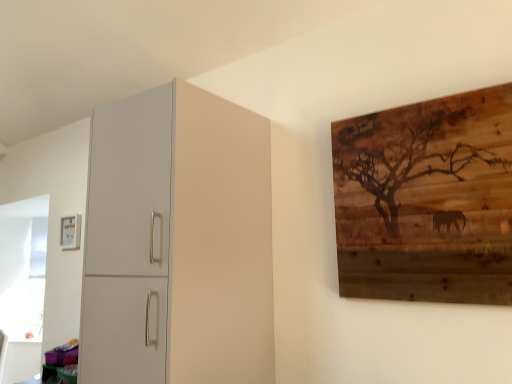
Question: Is wooden artwork at upper right, arranged as the second picture frame when viewed from the back, oriented towards matte white cabinet at left?

Choices:
 (A) yes
 (B) no

Answer: (B)

Question: Is wooden artwork at upper right, acting as the 2th picture frame starting from the left, in contact with matte white cabinet at left?

Choices:
 (A) yes
 (B) no

Answer: (B)

Question: Is wooden artwork at upper right, acting as the 2th picture frame starting from the left, facing away from matte white cabinet at left?

Choices:
 (A) yes
 (B) no

Answer: (B)

Question: Is the depth of wooden artwork at upper right, acting as the 2th picture frame starting from the left, greater than that of matte white cabinet at left?

Choices:
 (A) no
 (B) yes

Answer: (A)

Question: Does wooden artwork at upper right, arranged as the 1th picture frame when viewed from the front, have a lesser width compared to matte white cabinet at left?

Choices:
 (A) no
 (B) yes

Answer: (B)

Question: Is wooden artwork at upper right, the 1th picture frame from the right, smaller than matte white cabinet at left?

Choices:
 (A) yes
 (B) no

Answer: (A)

Question: Considering the relative sizes of matte white picture frame at upper left, which is counted as the 2th picture frame, starting from the front, and wooden artwork at upper right, arranged as the second picture frame when viewed from the back, in the image provided, is matte white picture frame at upper left, which is counted as the 2th picture frame, starting from the front, taller than wooden artwork at upper right, arranged as the second picture frame when viewed from the back,?

Choices:
 (A) no
 (B) yes

Answer: (A)

Question: Does matte white picture frame at upper left, marked as the second picture frame in a right-to-left arrangement, have a larger size compared to wooden artwork at upper right, the 1th picture frame from the right?

Choices:
 (A) yes
 (B) no

Answer: (B)

Question: Is matte white picture frame at upper left, which is counted as the 2th picture frame, starting from the front, next to wooden artwork at upper right, arranged as the second picture frame when viewed from the back?

Choices:
 (A) no
 (B) yes

Answer: (A)

Question: From a real-world perspective, is matte white picture frame at upper left, the 1th picture frame when ordered from left to right, positioned over wooden artwork at upper right, arranged as the second picture frame when viewed from the back, based on gravity?

Choices:
 (A) no
 (B) yes

Answer: (B)

Question: Is matte white picture frame at upper left, which is counted as the 2th picture frame, starting from the front, at the left side of wooden artwork at upper right, arranged as the second picture frame when viewed from the back?

Choices:
 (A) no
 (B) yes

Answer: (B)

Question: Is the position of matte white picture frame at upper left, which is counted as the 2th picture frame, starting from the front, more distant than that of wooden artwork at upper right, arranged as the 1th picture frame when viewed from the front?

Choices:
 (A) no
 (B) yes

Answer: (B)

Question: Is matte white picture frame at upper left, marked as the second picture frame in a right-to-left arrangement, positioned before matte white cabinet at left?

Choices:
 (A) yes
 (B) no

Answer: (B)